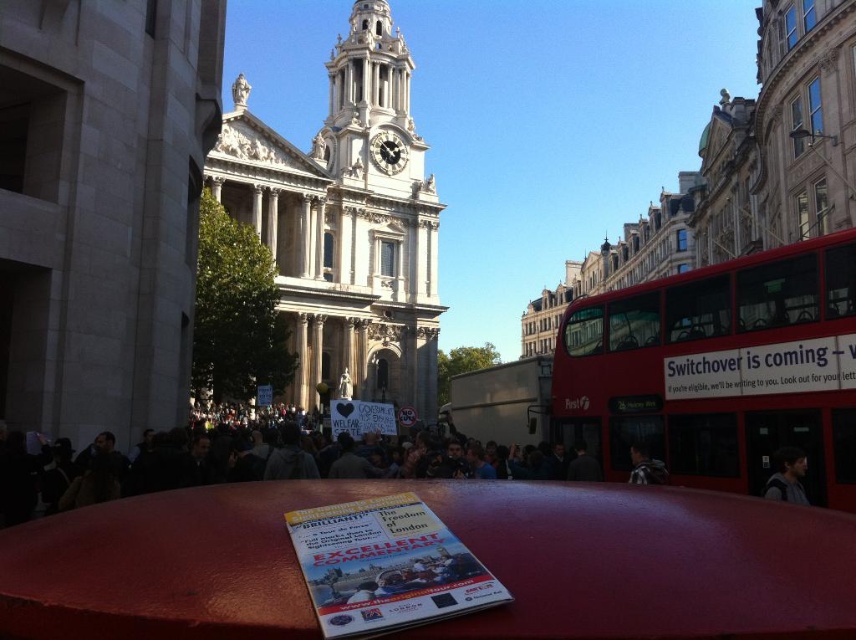
Is dark gray fabric crowd at center below dark gray fabric jacket at lower right?

Yes.

Is dark gray fabric crowd at center to the left of dark gray fabric jacket at lower right from the viewer's perspective?

Indeed, dark gray fabric crowd at center is positioned on the left side of dark gray fabric jacket at lower right.

Image resolution: width=856 pixels, height=640 pixels. What are the coordinates of `dark gray fabric crowd at center` in the screenshot? It's located at (239, 467).

Who is more forward, (706, 269) or (795, 492)?

Point (795, 492)

Looking at this image, who is positioned more to the right, red metallic bus at right or dark gray fabric jacket at lower right?

Positioned to the right is dark gray fabric jacket at lower right.

In the scene shown: Who is more forward, (x=758, y=385) or (x=771, y=496)?

Point (x=771, y=496) is more forward.

Identify the location of red metallic bus at right. This screenshot has width=856, height=640. (720, 369).

Can you confirm if dark gray fabric jacket at lower right is positioned to the left of dark brown leather jacket at center?

In fact, dark gray fabric jacket at lower right is to the right of dark brown leather jacket at center.

Which is behind, point (783, 486) or point (635, 464)?

Point (635, 464)

The height and width of the screenshot is (640, 856). Identify the location of dark gray fabric jacket at lower right. (788, 477).